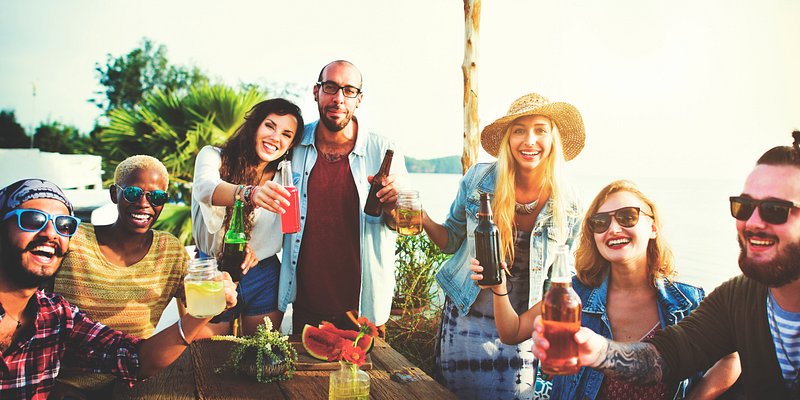
Locate an element on the screen. The width and height of the screenshot is (800, 400). bottles is located at coordinates click(484, 251), click(554, 300), click(376, 190), click(292, 207), click(234, 243).